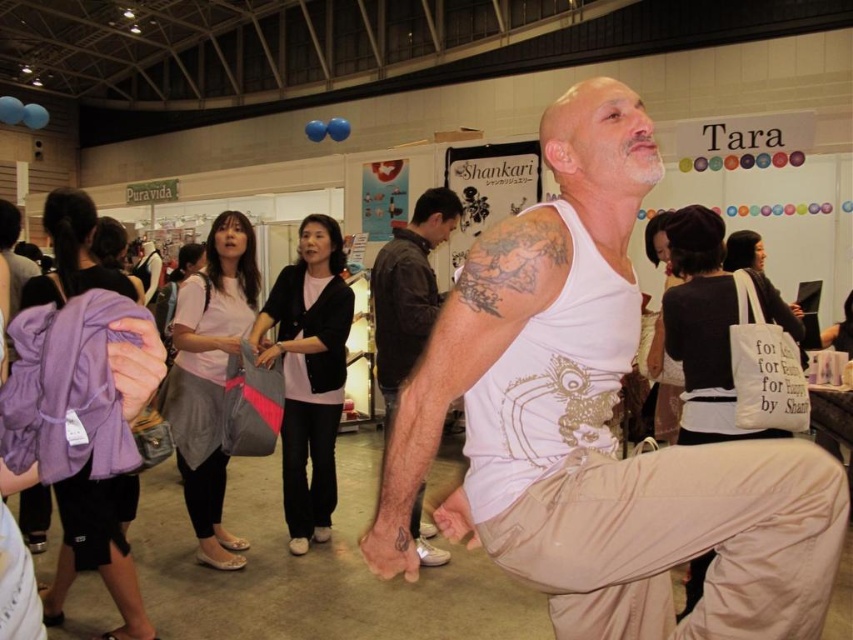
Question: Is white matte tank top at center further to camera compared to hairy skin tattoo at center?

Choices:
 (A) yes
 (B) no

Answer: (B)

Question: Among these points, which one is farthest from the camera?

Choices:
 (A) (697, 502)
 (B) (386, 269)

Answer: (B)

Question: Which object appears closest to the camera in this image?

Choices:
 (A) hairy skin tattoo at center
 (B) white matte tank top at center

Answer: (B)

Question: Is white matte tank top at center below hairy skin tattoo at center?

Choices:
 (A) no
 (B) yes

Answer: (B)

Question: Where is white matte tank top at center located in relation to hairy skin tattoo at center in the image?

Choices:
 (A) left
 (B) right

Answer: (B)